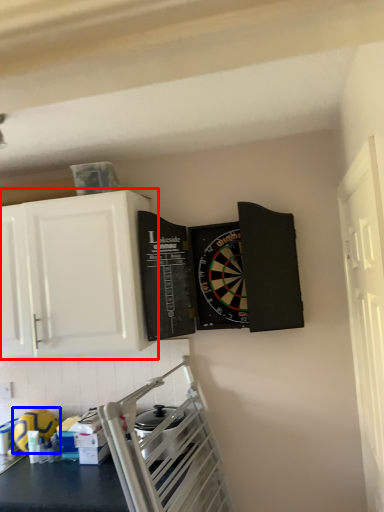
Question: Which point is closer to the camera, cabinetry (highlighted by a red box) or appliance (highlighted by a blue box)?

Choices:
 (A) cabinetry
 (B) appliance

Answer: (A)